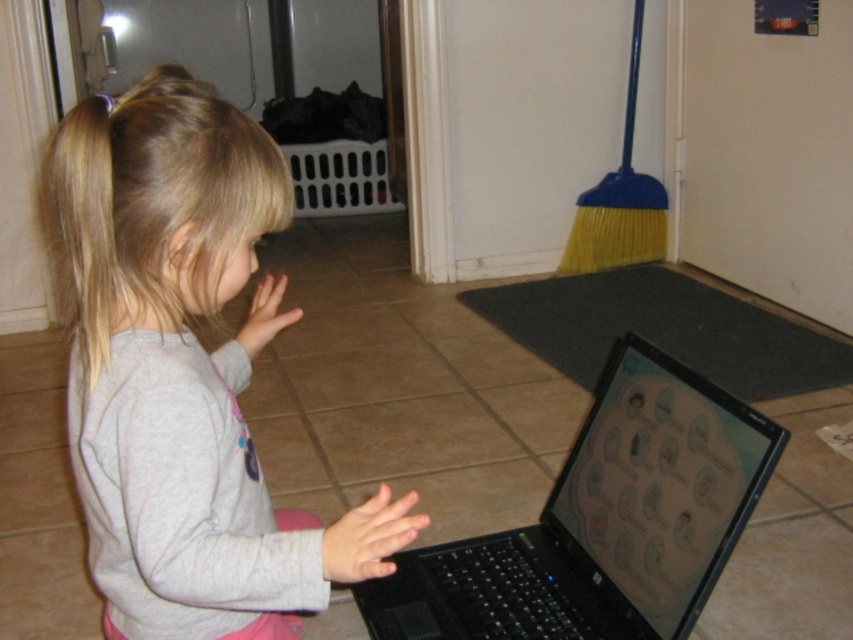
Question: Does gray soft fabric at center come in front of black plastic laptop at center?

Choices:
 (A) no
 (B) yes

Answer: (B)

Question: Among these objects, which one is farthest from the camera?

Choices:
 (A) gray soft fabric at center
 (B) black plastic laptop at center

Answer: (B)

Question: Which of the following is the farthest from the observer?

Choices:
 (A) gray soft fabric at center
 (B) black plastic laptop at center

Answer: (B)

Question: Can you confirm if gray soft fabric at center is positioned above black plastic laptop at center?

Choices:
 (A) no
 (B) yes

Answer: (B)

Question: Can you confirm if gray soft fabric at center is positioned to the left of black plastic laptop at center?

Choices:
 (A) no
 (B) yes

Answer: (B)